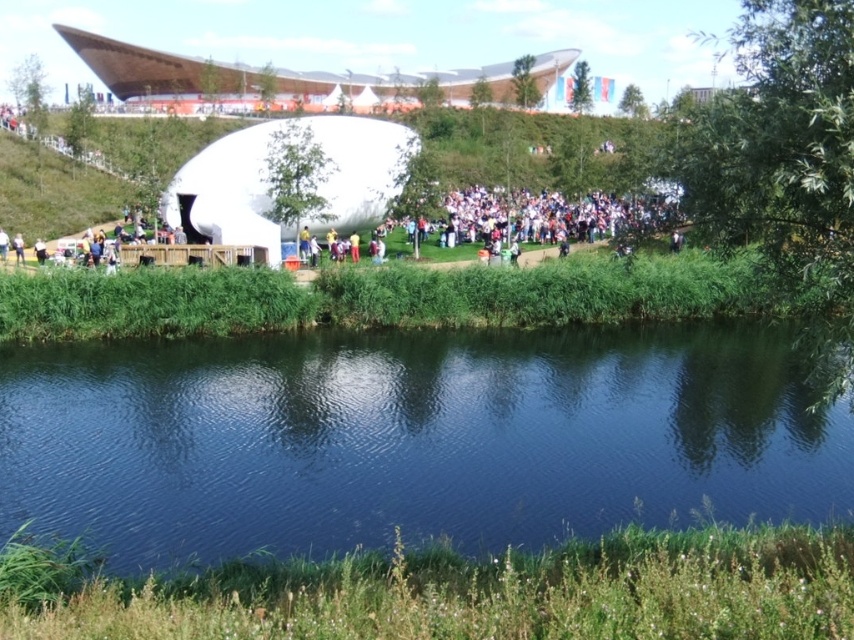
Is point (303, 227) in front of point (355, 234)?

Yes, point (303, 227) is in front of point (355, 234).

Who is taller, blue fabric person at center or yellow fabric person at center?

blue fabric person at center

Locate an element on the screen. The image size is (854, 640). blue fabric person at center is located at coordinates (303, 243).

Does dark blue water at center have a larger size compared to light brown fabric person at lower left?

Yes.

Is point (465, 460) closer to camera compared to point (18, 234)?

Yes.

Find the location of `dark blue water at center`. dark blue water at center is located at coordinates (411, 438).

Which of these two, light brown fabric person at lower left or white matte person at center, stands taller?

Standing taller between the two is light brown fabric person at lower left.

Consider the image. Who is positioned more to the right, light brown fabric person at lower left or white matte person at center?

light brown fabric person at lower left

What are the coordinates of `light brown fabric person at lower left` in the screenshot? It's located at (18, 248).